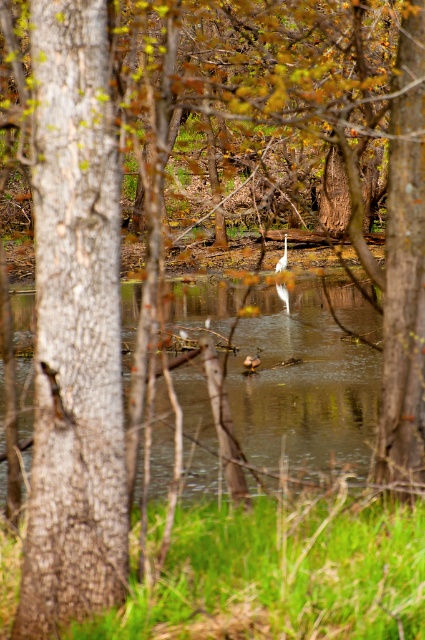
Does rough bark tree at left have a lesser width compared to clear water at center?

Correct, rough bark tree at left's width is less than clear water at center's.

This screenshot has width=425, height=640. I want to click on rough bark tree at left, so click(x=74, y=326).

Does point (68, 84) lie in front of point (201, 432)?

That is True.

This screenshot has width=425, height=640. In order to click on rough bark tree at left in this screenshot , I will do `click(74, 326)`.

Who is positioned more to the right, rough bark tree at left or white matte bird at center?

Positioned to the right is white matte bird at center.

Is rough bark tree at left shorter than white matte bird at center?

Incorrect, rough bark tree at left's height does not fall short of white matte bird at center's.

Which is behind, point (42, 141) or point (275, 262)?

The point (275, 262) is behind.

You are a GUI agent. You are given a task and a screenshot of the screen. Output one action in this format:
    pyautogui.click(x=<x>, y=<y>)
    Task: Click on the rough bark tree at left
    The image size is (425, 640).
    Given the screenshot: What is the action you would take?
    pyautogui.click(x=74, y=326)

Consider the image. Who is more distant from viewer, (252,452) or (278,262)?

The point (278,262) is behind.

Between clear water at center and white matte bird at center, which one appears on the right side from the viewer's perspective?

From the viewer's perspective, white matte bird at center appears more on the right side.

Identify the location of clear water at center. (306, 378).

Identify the location of clear water at center. click(306, 378).